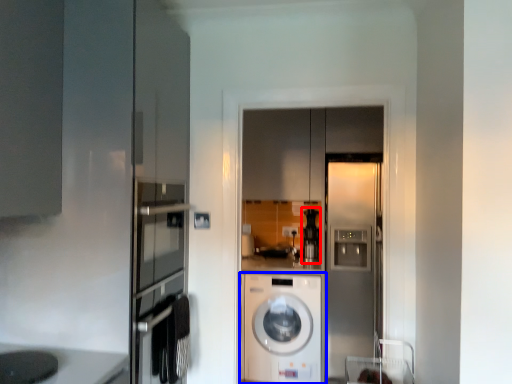
Question: Which object appears farthest to the camera in this image, coffee machine (highlighted by a red box) or washing machine (highlighted by a blue box)?

Choices:
 (A) coffee machine
 (B) washing machine

Answer: (A)